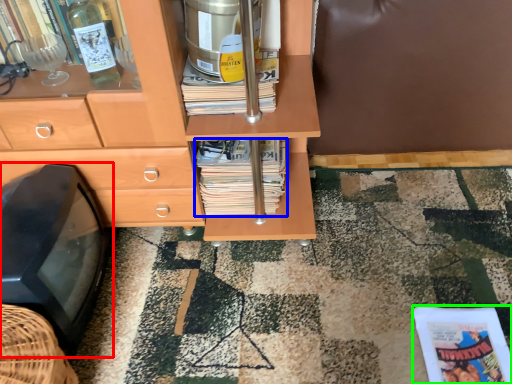
Question: Estimate the real-world distances between objects in this image. Which object is closer to flat (highlighted by a red box), magazine (highlighted by a blue box) or paperback book (highlighted by a green box)?

Choices:
 (A) magazine
 (B) paperback book

Answer: (A)